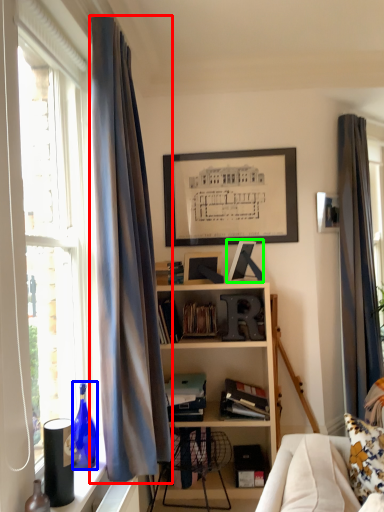
Question: Which object is positioned farthest from curtain (highlighted by a red box)? Select from bottle (highlighted by a blue box) and picture frame (highlighted by a green box).

Choices:
 (A) bottle
 (B) picture frame

Answer: (B)